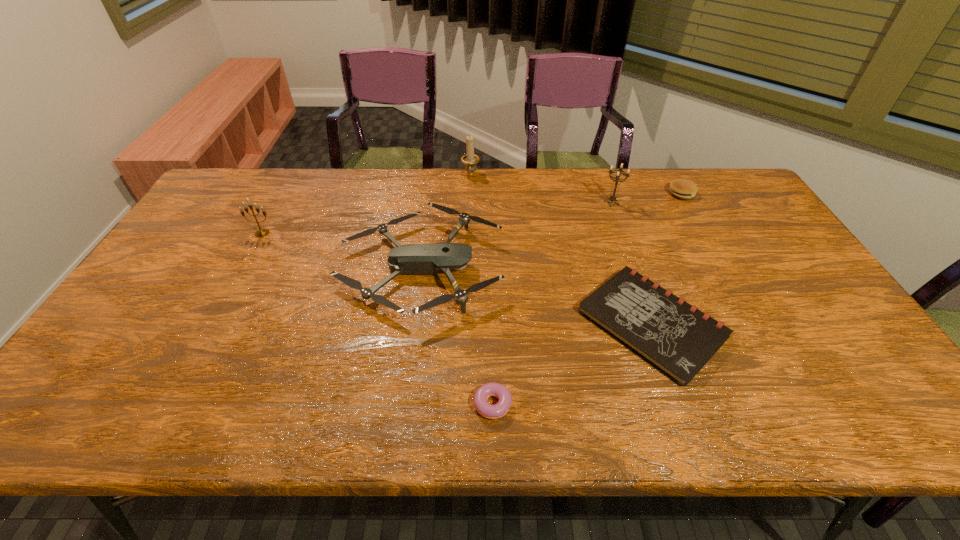
This screenshot has height=540, width=960. I want to click on the second candelabrum from left to right, so click(x=470, y=160).

Identify the location of the farthest candelabrum. The image size is (960, 540). (470, 160).

Image resolution: width=960 pixels, height=540 pixels. Find the location of `the rightmost candelabrum`. the rightmost candelabrum is located at coordinates (612, 198).

The image size is (960, 540). Find the location of `the nearest candelabrum`. the nearest candelabrum is located at coordinates (264, 232).

This screenshot has width=960, height=540. What are the coordinates of `the leftmost object` in the screenshot? It's located at (264, 232).

Where is `the fourth tallest object`? This screenshot has height=540, width=960. the fourth tallest object is located at coordinates (416, 259).

Where is `the rightmost object`? This screenshot has height=540, width=960. the rightmost object is located at coordinates (681, 188).

You are a GUI agent. You are given a task and a screenshot of the screen. Output one action in this format:
    pyautogui.click(x=<x>, y=<y>)
    Task: Click on the patty
    
    Given the screenshot: What is the action you would take?
    pyautogui.click(x=681, y=188)

The height and width of the screenshot is (540, 960). Identify the location of notebook. (678, 339).

The height and width of the screenshot is (540, 960). Find the location of `doughnut`. doughnut is located at coordinates (487, 410).